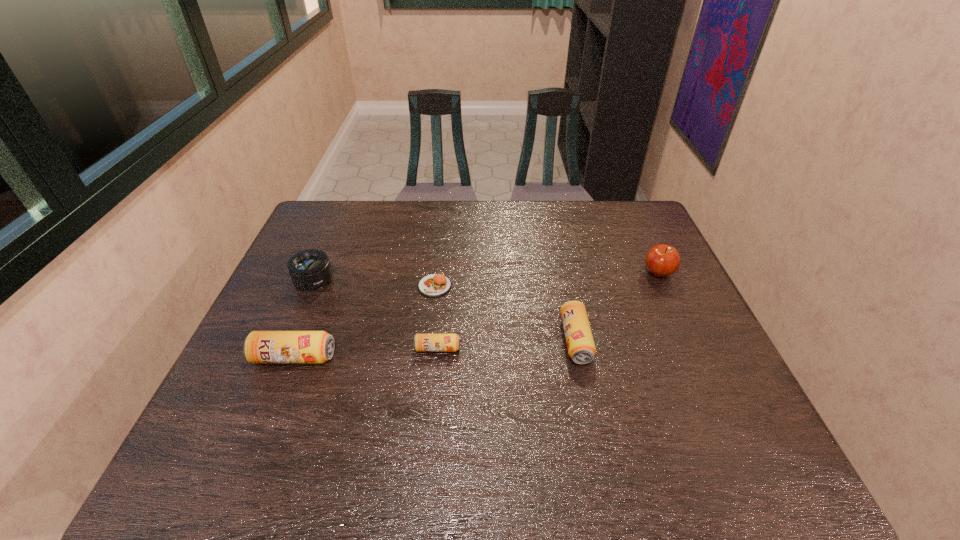
At what (x,y) coordinates should I click in order to perform the action: click on vacant space positioned on the right of the shortest beer can. Please return your answer as a coordinate pair (x, y). The width and height of the screenshot is (960, 540). Looking at the image, I should click on (504, 348).

Where is `blank space located on the front of the second object from right to left`? This screenshot has height=540, width=960. blank space located on the front of the second object from right to left is located at coordinates (590, 411).

Locate an element on the screen. The image size is (960, 540). free space located 0.170m on the left of the shortest object is located at coordinates (359, 286).

I want to click on vacant space located on the side of the telephoto lens with brand markings and control switches, so click(x=258, y=411).

At what (x,y) coordinates should I click in order to perform the action: click on vacant space situated on the left of the rightmost object. Please return your answer as a coordinate pair (x, y). Looking at the image, I should click on (547, 273).

Identify the location of beer can at the left edge. (259, 346).

At what (x,y) coordinates should I click in order to perform the action: click on telephoto lens located in the left edge section of the desktop. Please return your answer as a coordinate pair (x, y). The height and width of the screenshot is (540, 960). Looking at the image, I should click on (309, 270).

The image size is (960, 540). Identify the location of object that is at the right edge. (662, 260).

Image resolution: width=960 pixels, height=540 pixels. Find the location of `vacant space at the far edge of the desktop`. vacant space at the far edge of the desktop is located at coordinates (389, 207).

Locate an element on the screen. free spot at the near edge of the desktop is located at coordinates (553, 399).